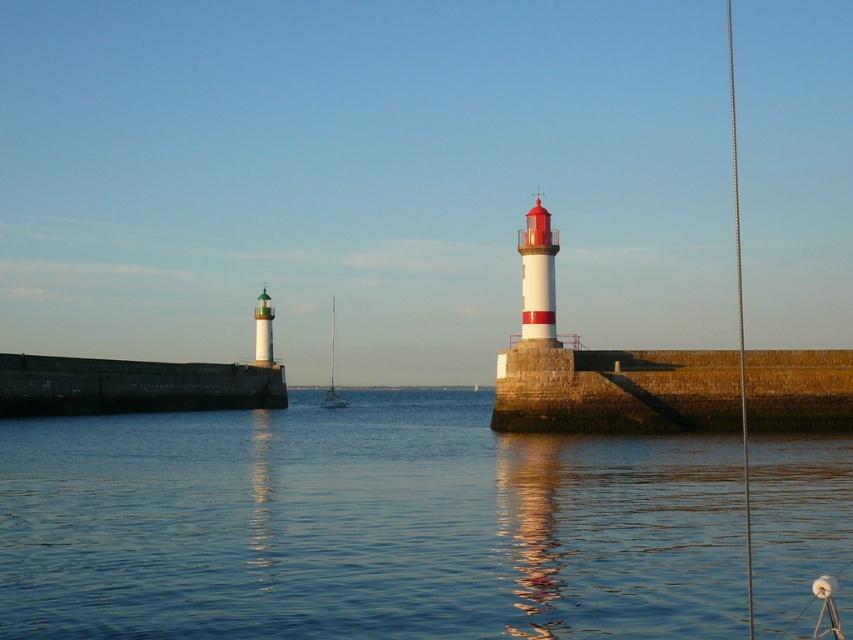
You are a ship captain navigating into the harbor and see the brown stone wall at right. Based on its position, can you estimate where it is located in the image?

The brown stone wall at right is located at the coordinates point (616,390) in the image.

You are standing on a boat anchored 50 meters away from the brown stone wall at right. Can you safely approach the wall without worrying about hitting it?

The distance between you and the brown stone wall at right is 66.21 meters, so you can safely approach the wall without hitting it since you are only 50 meters away from it.

You are a sailor planning to dock your boat at the harbor. You see the transparent water at center and the white plastic sailboat at center. Which one is wider?

The transparent water at center might be wider than white plastic sailboat at center.